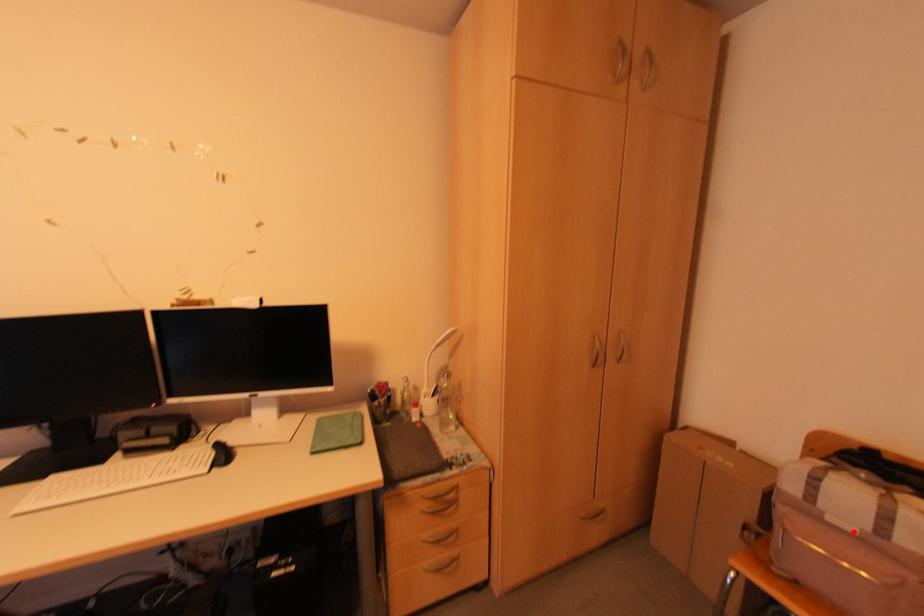
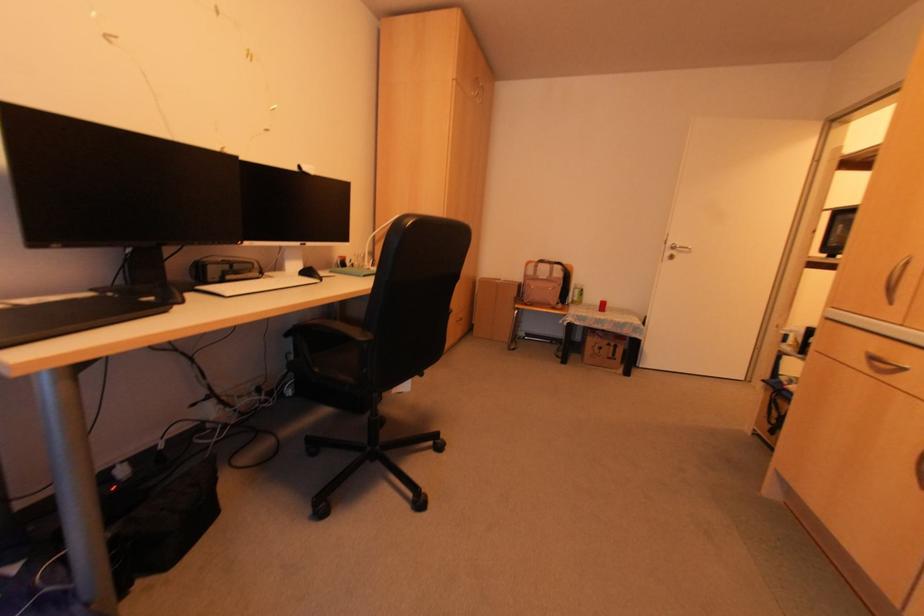
Question: I am providing you with two images of the same scene from different viewpoints. Image1 has a red point marked. In image2, the corresponding 3D location appears at what relative position? Reply with the corresponding letter.

Choices:
 (A) Closer
 (B) Farther

Answer: (B)